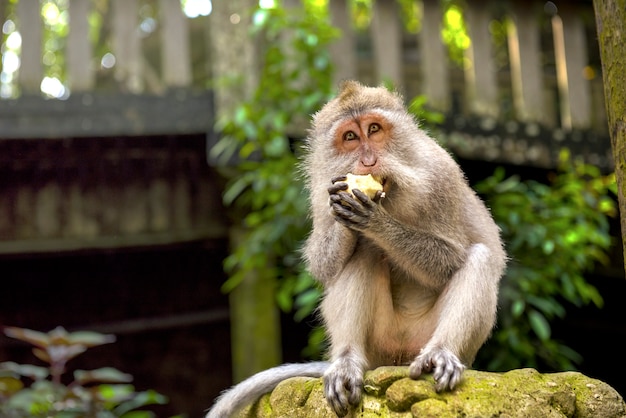
You are a GUI agent. You are given a task and a screenshot of the screen. Output one action in this format:
    pyautogui.click(x=<x>, y=<y>)
    Task: Click on the wooden planks/slats
    
    Given the screenshot: What is the action you would take?
    pyautogui.click(x=173, y=50)